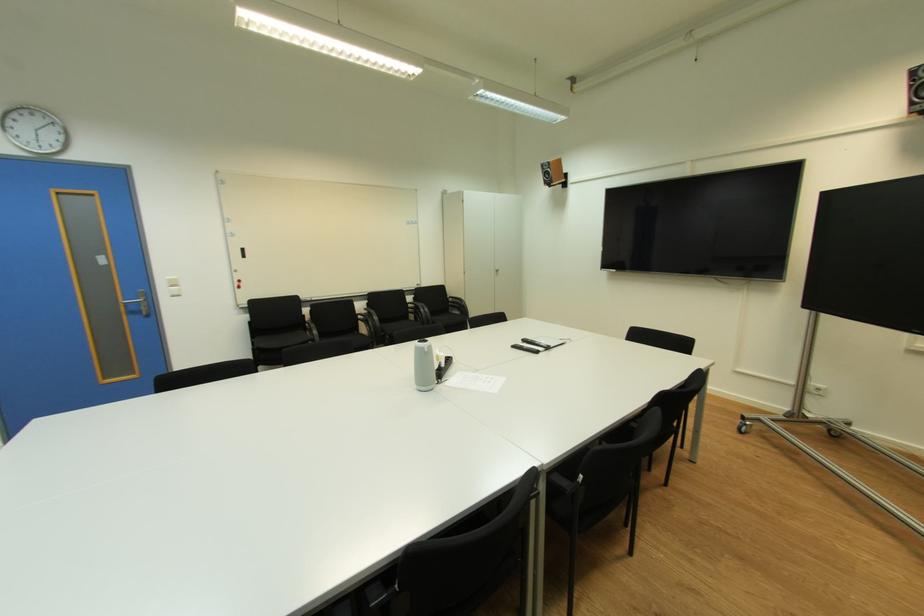
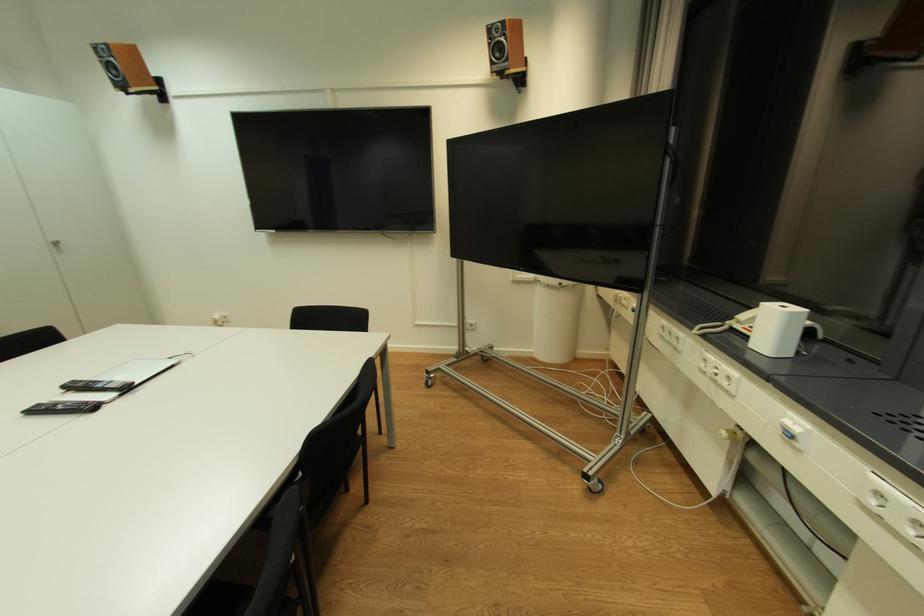
Find the pixel in the second image that matches point (502, 273) in the first image.

(57, 246)